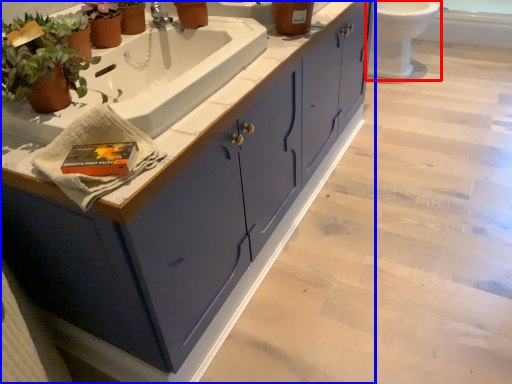
Question: Which object appears farthest to the camera in this image, toilet (highlighted by a red box) or bathroom cabinet (highlighted by a blue box)?

Choices:
 (A) toilet
 (B) bathroom cabinet

Answer: (A)